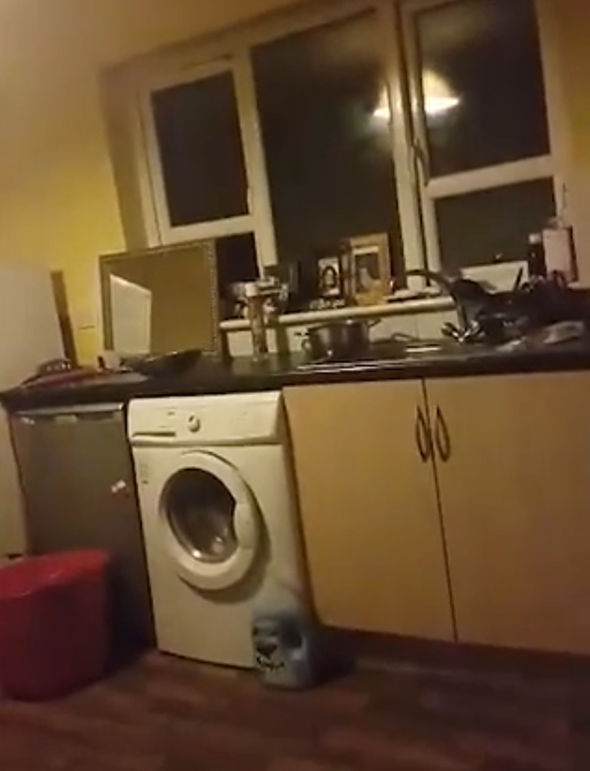
Where is `faucet`? faucet is located at coordinates coord(412,271).